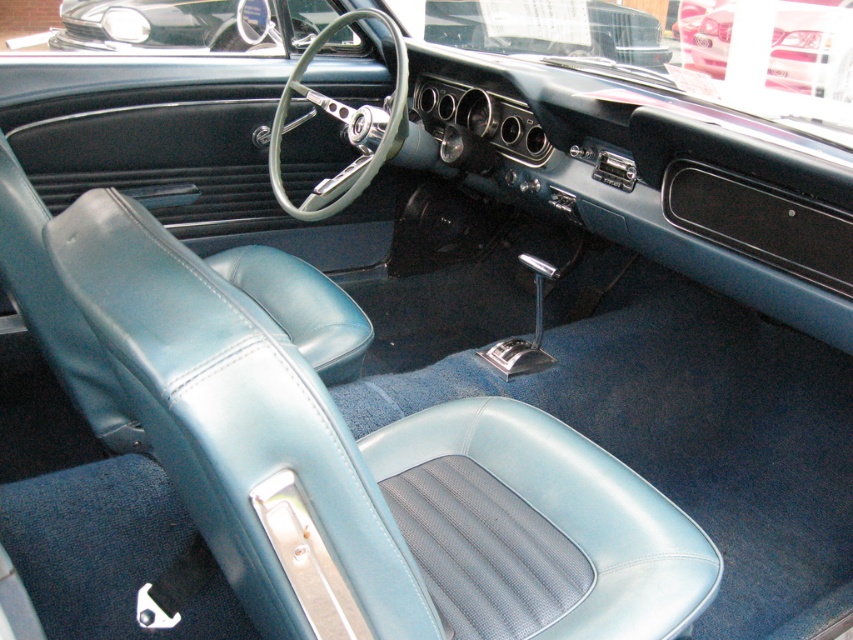
You are sitting in the vintage car and want to adjust the shiny chrome steering wheel at upper center. Based on its position, can you estimate if it is centered in the car or shifted to one side?

The shiny chrome steering wheel at upper center is located at point coordinates that are closer to the left side of the car, so it is slightly shifted to the left rather than being perfectly centered.

You are sitting in the driver seat of the vintage car and notice a point marked at coordinates (x=548, y=28). What object in the car corresponds to this point?

The shiny chrome steering wheel at upper center is represented by point (x=548, y=28).

You are sitting in the driver seat of the vintage car and looking forward. Which object is positioned lower between the shiny chrome steering wheel at upper center and the metallic silver car at upper center?

The shiny chrome steering wheel at upper center is positioned lower than the metallic silver car at upper center.